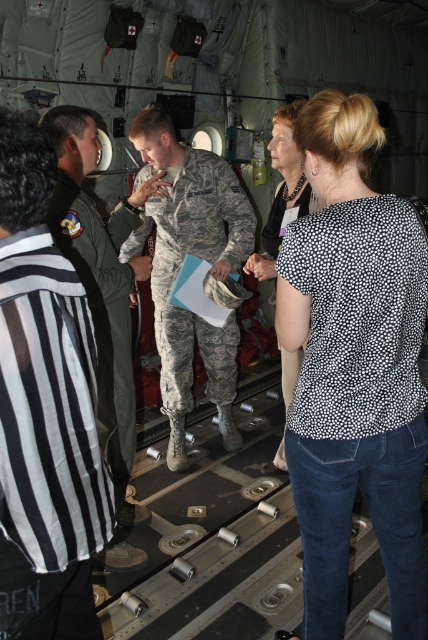
Question: Estimate the real-world distances between objects in this image. Which object is closer to the camouflage uniform at center?

Choices:
 (A) black dotted shirt at upper right
 (B) polka dot blouse at center

Answer: (B)

Question: Is white dotted blouse at upper right positioned before black striped shirt at left?

Choices:
 (A) no
 (B) yes

Answer: (A)

Question: Does black dotted shirt at upper right have a greater width compared to camouflage uniform at center?

Choices:
 (A) no
 (B) yes

Answer: (A)

Question: Which of the following is the closest to the observer?

Choices:
 (A) black dotted shirt at upper right
 (B) white dotted blouse at upper right
 (C) polka dot blouse at center

Answer: (A)

Question: Among these points, which one is nearest to the camera?

Choices:
 (A) (115, 252)
 (B) (142, 147)
 (C) (70, 627)

Answer: (C)

Question: Observing the image, what is the correct spatial positioning of black striped shirt at left in reference to polka dot blouse at center?

Choices:
 (A) left
 (B) right

Answer: (A)